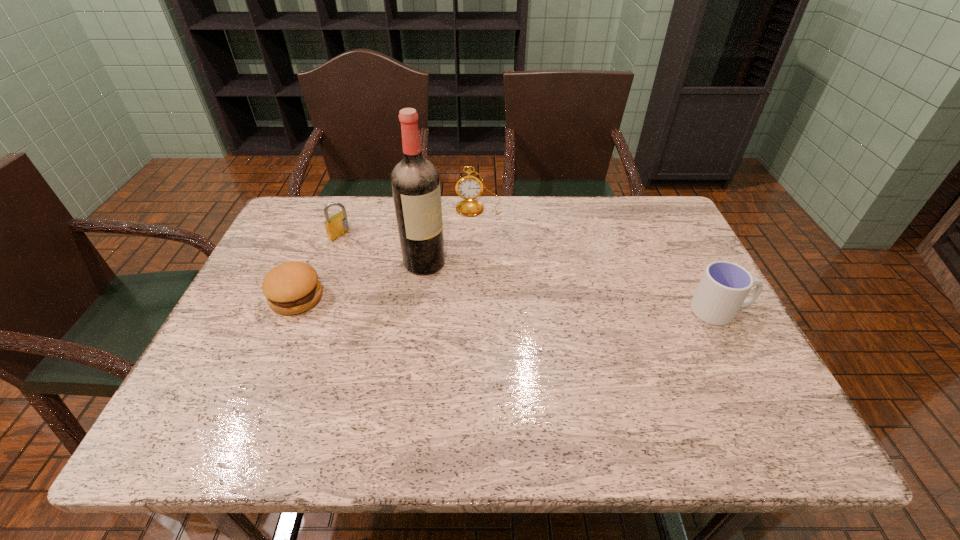
Identify the location of the shortest object. Image resolution: width=960 pixels, height=540 pixels. (290, 288).

Image resolution: width=960 pixels, height=540 pixels. Identify the location of the rightmost object. (724, 286).

Locate an element on the screen. The width and height of the screenshot is (960, 540). the third nearest object is located at coordinates (415, 181).

Find the location of a particular element. The image size is (960, 540). liquor is located at coordinates [x=415, y=181].

Identify the location of pocket watch. coord(469,187).

Find the location of a particular element. the farthest object is located at coordinates (469, 187).

Identify the location of the fourth nearest object. (337, 225).

The width and height of the screenshot is (960, 540). Identify the location of vacant space located 0.290m on the right of the hamburger. (439, 298).

This screenshot has width=960, height=540. I want to click on vacant space situated 0.200m on the front-facing side of the third object from left to right, so click(x=496, y=309).

Find the location of a particular element. This screenshot has width=960, height=540. free region located on the front-facing side of the third object from left to right is located at coordinates (484, 301).